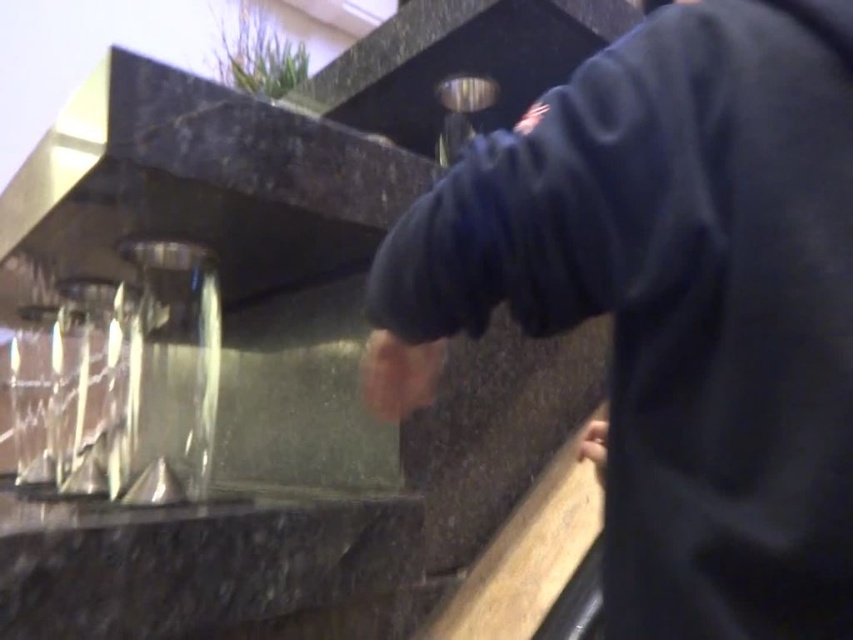
Between point (804, 506) and point (122, 634), which one is positioned behind?

The point (122, 634) is more distant.

Who is taller, dark blue sweatshirt at center or black marble counter at lower left?

dark blue sweatshirt at center is taller.

This screenshot has width=853, height=640. Describe the element at coordinates (675, 301) in the screenshot. I see `dark blue sweatshirt at center` at that location.

I want to click on dark blue sweatshirt at center, so click(x=675, y=301).